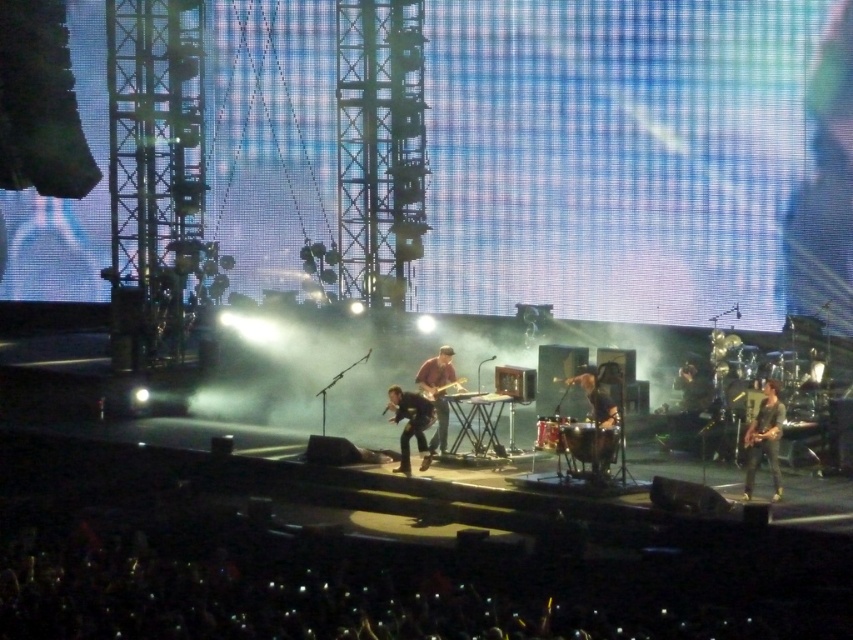
Question: Which object appears farthest from the camera in this image?

Choices:
 (A) shiny silver drum at center
 (B) shiny black guitar at center
 (C) shiny black guitar at right
 (D) matte brown guitar at center

Answer: (D)

Question: From the image, what is the correct spatial relationship of shiny black guitar at right in relation to shiny black guitar at center?

Choices:
 (A) below
 (B) above

Answer: (B)

Question: Which point is closer to the camera?

Choices:
 (A) matte brown guitar at center
 (B) shiny silver drum at center
 (C) shiny black guitar at center

Answer: (B)

Question: Which of these objects is positioned farthest from the matte brown guitar at center?

Choices:
 (A) shiny black guitar at center
 (B) shiny black guitar at right
 (C) shiny silver drum at center

Answer: (B)

Question: Does shiny black guitar at center appear under matte brown guitar at center?

Choices:
 (A) yes
 (B) no

Answer: (A)

Question: In this image, where is shiny black guitar at right located relative to matte brown guitar at center?

Choices:
 (A) left
 (B) right

Answer: (B)